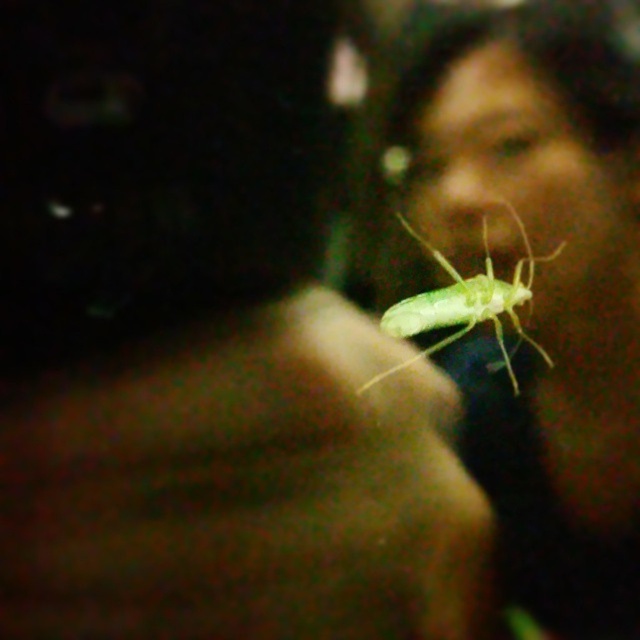
Question: In this image, where is green translucent insect at upper right located relative to green translucent insect at center?

Choices:
 (A) below
 (B) above

Answer: (A)

Question: Does green translucent insect at upper right have a greater width compared to green translucent insect at center?

Choices:
 (A) yes
 (B) no

Answer: (A)

Question: Which object is farther from the camera taking this photo?

Choices:
 (A) green translucent insect at upper right
 (B) green translucent insect at center

Answer: (B)

Question: Which point appears farthest from the camera in this image?

Choices:
 (A) (400, 316)
 (B) (570, 602)

Answer: (A)

Question: Can you confirm if green translucent insect at upper right is positioned to the right of green translucent insect at center?

Choices:
 (A) yes
 (B) no

Answer: (A)

Question: Which of the following is the farthest from the observer?

Choices:
 (A) (412, 330)
 (B) (508, 586)

Answer: (A)